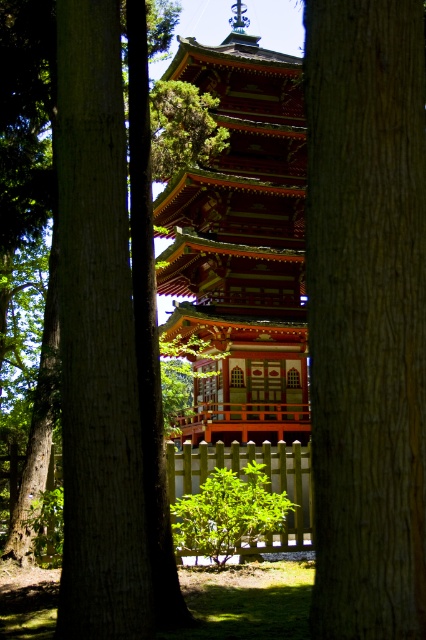
You are a visitor standing at the entrance of the pagoda garden. You notice the smooth brown tree trunk at center and the shiny lacquered pagoda at center. Which object is taller?

The shiny lacquered pagoda at center is taller than the smooth brown tree trunk at center.

Based on the photo, you are standing at the entrance of the pagoda and want to find the brown rough tree trunk at center. According to the coordinates provided, where should you look relative to the pagoda?

The brown rough tree trunk at center is located at coordinates point (365, 314), which places it near the center of the image, slightly to the right and lower portion relative to the pagoda.